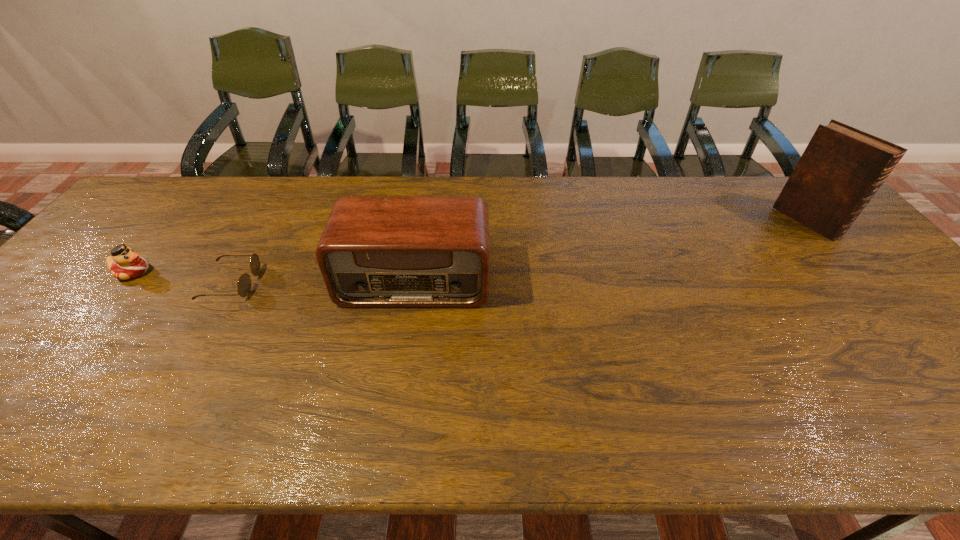
This screenshot has height=540, width=960. Find the location of `free spot located 0.200m on the face of the duck`. free spot located 0.200m on the face of the duck is located at coordinates (225, 272).

Find the location of a particular element. blank space located 0.170m on the lenses of the third object from right to left is located at coordinates (321, 283).

Image resolution: width=960 pixels, height=540 pixels. What are the coordinates of `object present at the far edge` in the screenshot? It's located at (841, 169).

This screenshot has height=540, width=960. Find the location of `object that is at the left edge`. object that is at the left edge is located at coordinates (124, 263).

Locate an element on the screen. The image size is (960, 540). object at the right edge is located at coordinates (841, 169).

Locate an element on the screen. The width and height of the screenshot is (960, 540). object present at the far right corner is located at coordinates pyautogui.click(x=841, y=169).

In the image, there is a desktop. At what (x,y) coordinates should I click in order to perform the action: click on vacant region at the far edge. Please return your answer as a coordinate pair (x, y). This screenshot has width=960, height=540. Looking at the image, I should click on (745, 180).

Where is `vacant space at the near edge of the desktop`? This screenshot has height=540, width=960. vacant space at the near edge of the desktop is located at coordinates (481, 419).

Where is `vacant space at the left edge of the desktop`? vacant space at the left edge of the desktop is located at coordinates (61, 337).

Find the location of a particular element. This screenshot has height=540, width=960. free space between the leftmost object and the radio receiver is located at coordinates (274, 276).